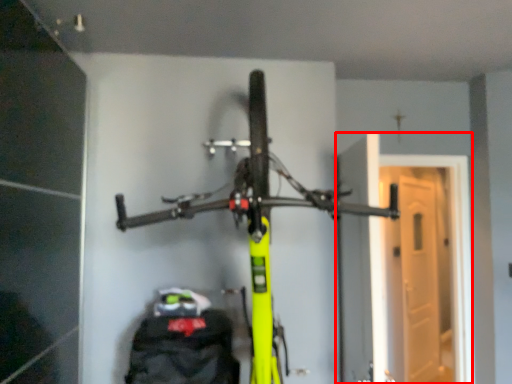
Question: From the image's perspective, where is garage door (annotated by the red box) located in relation to bicycle in the image?

Choices:
 (A) below
 (B) above

Answer: (A)